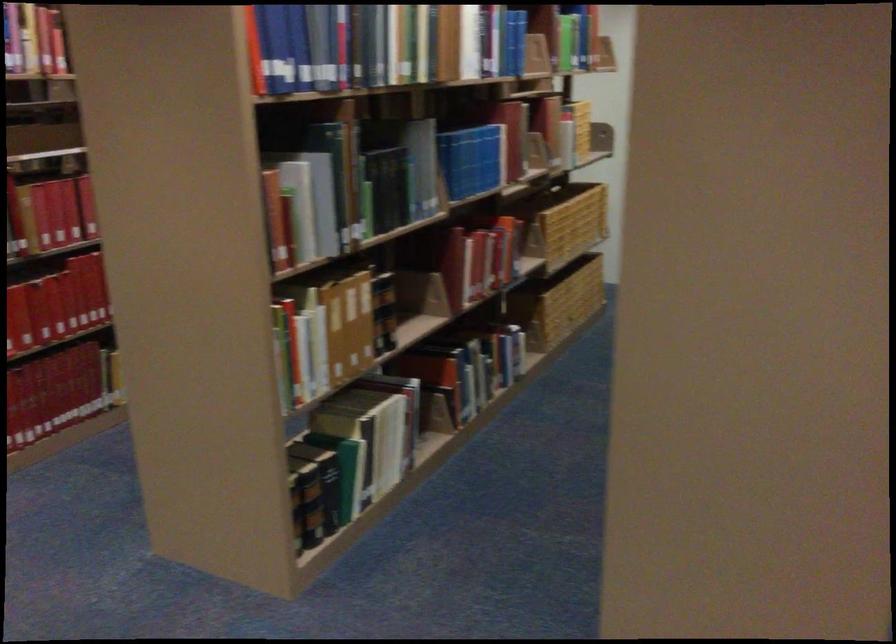
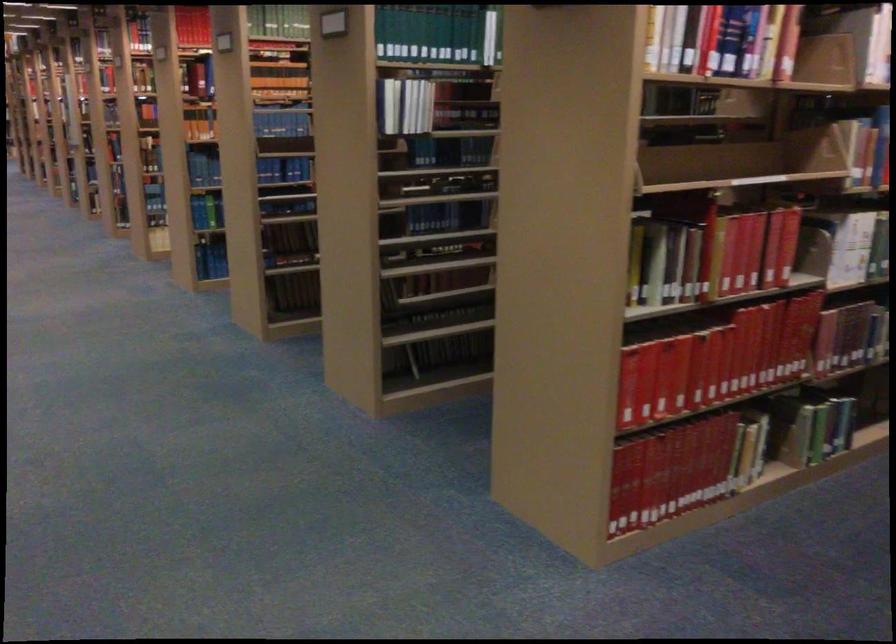
Locate, in the second image, the point that corresponds to (71,210) in the first image.

(754, 250)